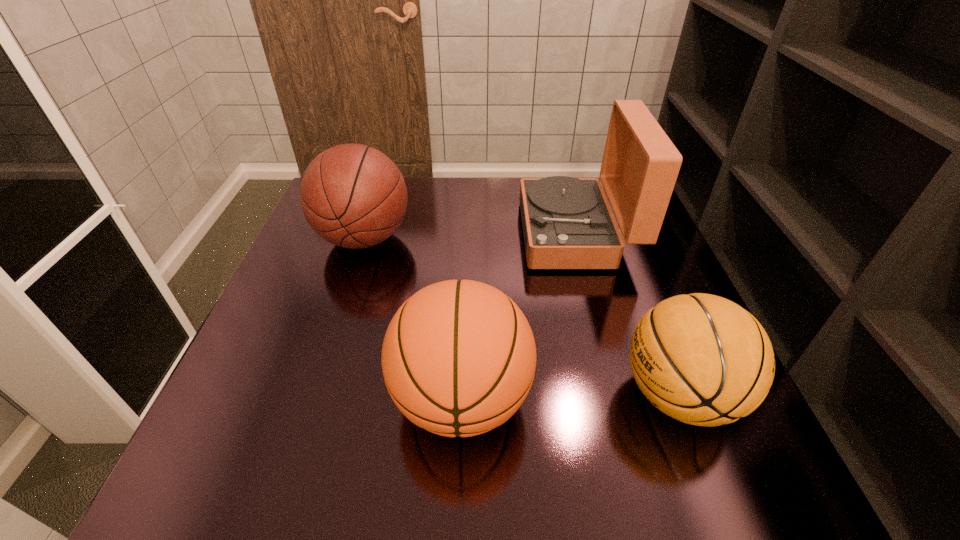
You are a GUI agent. You are given a task and a screenshot of the screen. Output one action in this format:
    pyautogui.click(x=<x>, y=<y>)
    Task: Click on the free space located on the left of the second basketball from right to left
    The image size is (960, 540).
    Given the screenshot: What is the action you would take?
    click(x=348, y=399)

I want to click on free space located 0.280m on the surface of the rightmost basketball near the brand logo, so [x=464, y=395].

At what (x,y) coordinates should I click in order to perform the action: click on vacant position located on the surface of the rightmost basketball near the brand logo. Please return your answer as a coordinate pair (x, y). Looking at the image, I should click on (442, 395).

This screenshot has width=960, height=540. Find the location of `blank space located 0.320m on the surface of the rightmost basketball near the brand logo`. blank space located 0.320m on the surface of the rightmost basketball near the brand logo is located at coordinates 442,395.

Locate an element on the screen. The height and width of the screenshot is (540, 960). phonograph record at the far edge is located at coordinates (567, 222).

Where is `basketball present at the far edge`? The height and width of the screenshot is (540, 960). basketball present at the far edge is located at coordinates (354, 196).

At what (x,y) coordinates should I click in order to perform the action: click on object present at the left edge. Please return your answer as a coordinate pair (x, y). This screenshot has width=960, height=540. Looking at the image, I should click on (354, 196).

Image resolution: width=960 pixels, height=540 pixels. Identify the location of phonograph record at the right edge. (567, 222).

Where is `basketball located in the right edge section of the desktop`? This screenshot has height=540, width=960. basketball located in the right edge section of the desktop is located at coordinates (702, 359).

Locate an element on the screen. The height and width of the screenshot is (540, 960). object that is at the far left corner is located at coordinates (354, 196).